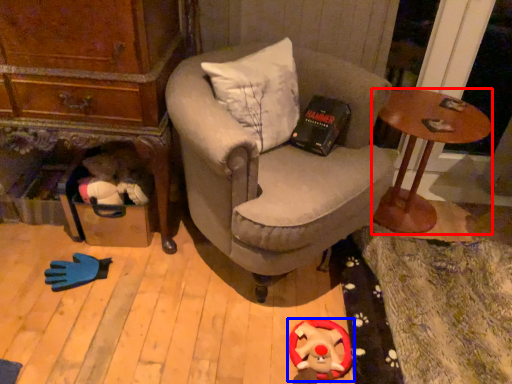
Question: Which point is closer to the camera, desk (highlighted by a red box) or toy (highlighted by a blue box)?

Choices:
 (A) desk
 (B) toy

Answer: (B)